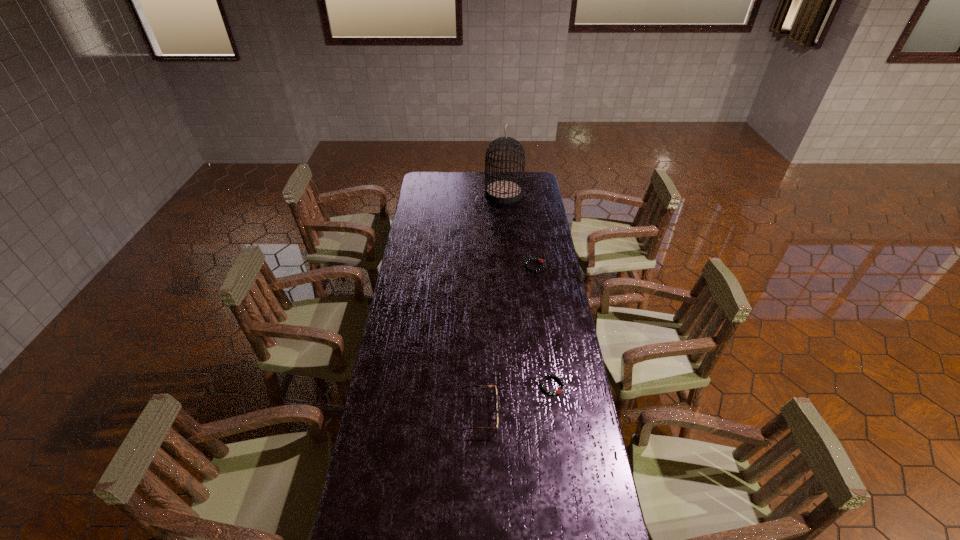
The image size is (960, 540). In order to click on birdcage that is positioned at the right edge in this screenshot , I will do `click(504, 191)`.

Image resolution: width=960 pixels, height=540 pixels. Find the location of `object present at the far right corner`. object present at the far right corner is located at coordinates (504, 191).

Identify the location of vacant region at the left edge. The width and height of the screenshot is (960, 540). (388, 355).

Locate an element on the screen. This screenshot has height=540, width=960. vacant region at the right edge of the desktop is located at coordinates point(540,310).

Locate an element on the screen. This screenshot has width=960, height=540. vacant space at the far left corner of the desktop is located at coordinates (432, 177).

Where is `vacant region at the far right corner of the desktop`? This screenshot has height=540, width=960. vacant region at the far right corner of the desktop is located at coordinates (530, 175).

You are a GUI agent. You are given a task and a screenshot of the screen. Output one action in this format:
    pyautogui.click(x=<x>, y=<y>)
    Task: Click on the unoccupied position between the farther bracelet and the second tallest object
    This screenshot has width=960, height=540.
    Given the screenshot: What is the action you would take?
    tap(507, 340)

You are a GUI agent. You are given a task and a screenshot of the screen. Output one action in this format:
    pyautogui.click(x=<x>, y=<y>)
    Task: Click on the unoccupied position between the second tallest object and the farther bracelet
    The image size is (960, 540).
    Given the screenshot: What is the action you would take?
    click(x=507, y=340)

Locate an element on the screen. Image resolution: width=960 pixels, height=540 pixels. free space between the second tallest object and the birdcage is located at coordinates (492, 303).

Where is `empty space that is in between the spectacles and the tallest object`? empty space that is in between the spectacles and the tallest object is located at coordinates (492, 303).